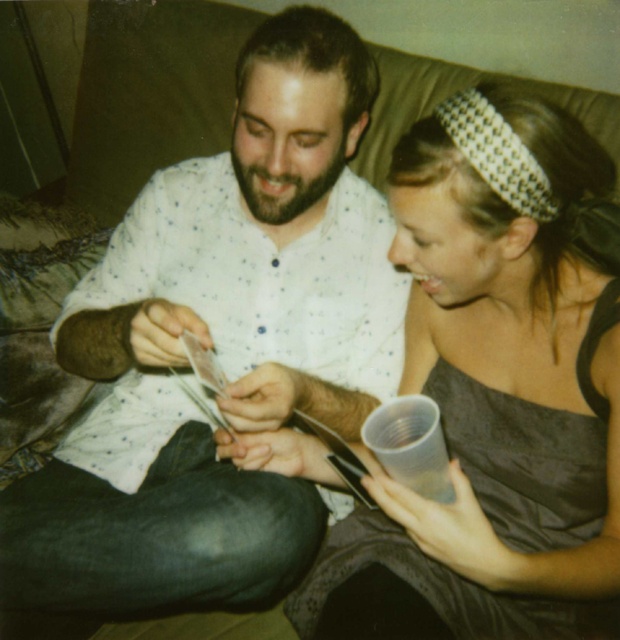
You are a photographer trying to capture a candid shot of the two people sitting on the couch. You want to ensure that the white dotted shirt at center and the matte gray dress at center are both clearly visible in the frame. Based on their positions, which one should you focus on first to ensure proper alignment?

The white dotted shirt at center is to the left of the matte gray dress at center, so you should focus on the white dotted shirt at center first to ensure proper alignment.